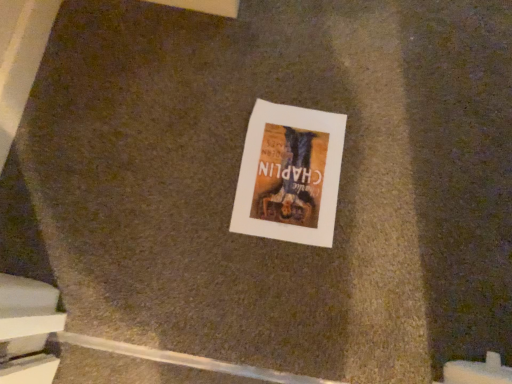
The height and width of the screenshot is (384, 512). I want to click on vacant area on top of matte paper poster at center (from a real-world perspective), so click(292, 172).